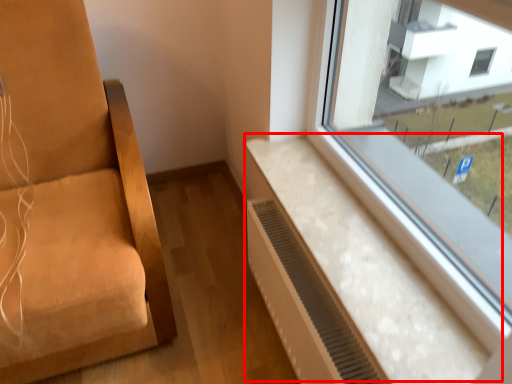
Question: From the image's perspective, what is the correct spatial relationship of window sill (annotated by the red box) in relation to air conditioner?

Choices:
 (A) below
 (B) above

Answer: (B)